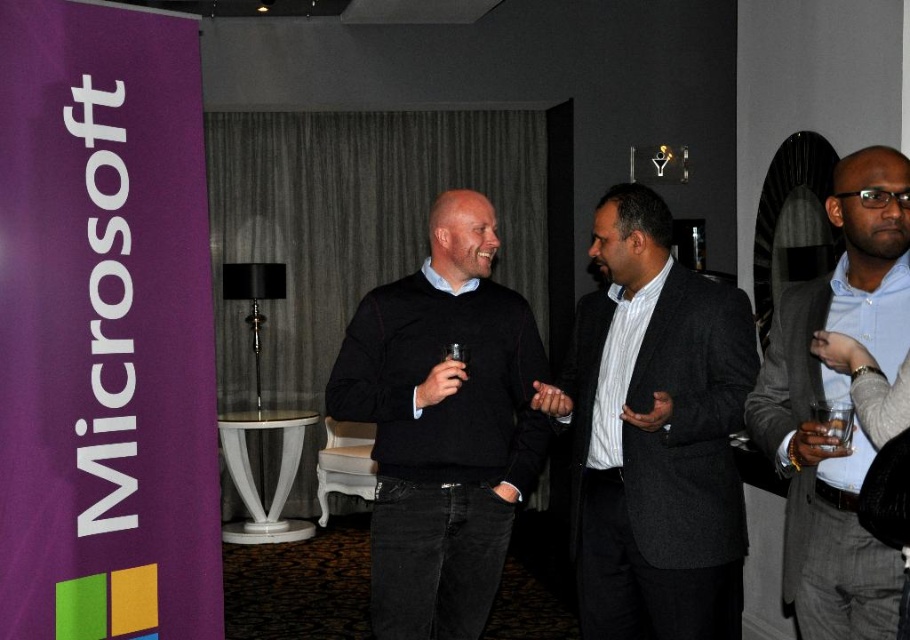
You are a photographer at the event and need to position yourself so that both the dark gray suit at center and the light blue shirt at right are visible in your shot. Based on their positions, which one should be placed higher in the frame to ensure both are fully visible?

The dark gray suit at center is below the light blue shirt at right, so to include both in the frame, position the light blue shirt at right higher up while ensuring the dark gray suit at center is lower in the frame.

You are standing in the room and want to place a small plant on the floor. You have two options for placement marked by points. The first point is at coordinate (650, 513) and the second is at (432, 624). Which point is closer to you?

Point (650, 513) is closer to the viewer than point (432, 624), so you should place the plant there.

You are a photographer at this event and want to capture a photo of the dark gray suit at center and the black sweater at center. Which one is positioned lower in the frame?

The dark gray suit at center is located below the black sweater at center, so it is positioned lower in the frame.